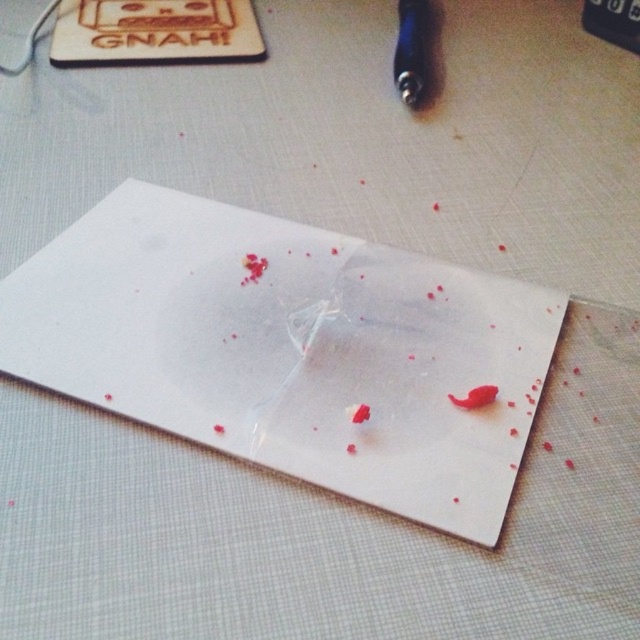
Question: Which object is the farthest from the blood matte liquid at lower right?

Choices:
 (A) metallic blue pen at upper right
 (B) white matte paper at center

Answer: (A)

Question: Which point is farther to the camera?

Choices:
 (A) (417, 33)
 (B) (493, 336)
 (C) (486, 396)

Answer: (A)

Question: Does white matte paper at center lie in front of blood matte liquid at lower right?

Choices:
 (A) no
 (B) yes

Answer: (B)

Question: Which point is closer to the camera taking this photo?

Choices:
 (A) (336, 396)
 (B) (404, 72)
 (C) (484, 401)

Answer: (C)

Question: Can you confirm if white matte paper at center is positioned below metallic blue pen at upper right?

Choices:
 (A) yes
 (B) no

Answer: (A)

Question: Does metallic blue pen at upper right have a greater width compared to blood matte liquid at lower right?

Choices:
 (A) yes
 (B) no

Answer: (A)